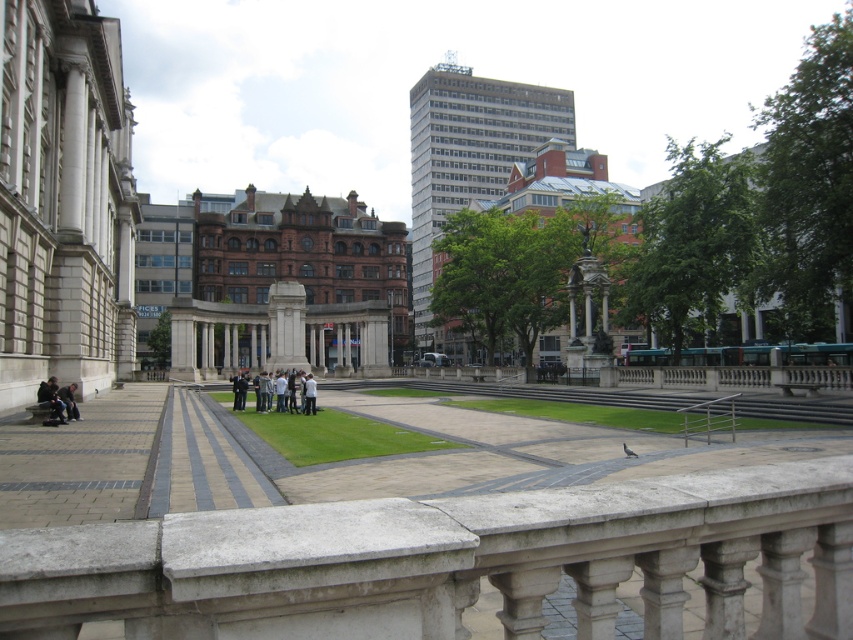
Question: Where is gray concrete path at center located in relation to dark gray stone bench at lower left in the image?

Choices:
 (A) below
 (B) above

Answer: (A)

Question: Which object is farther from the camera taking this photo?

Choices:
 (A) gray concrete path at center
 (B) light gray concrete people at center
 (C) dark gray stone bench at lower left
 (D) dark gray fabric jacket at lower left

Answer: (B)

Question: Which point is farther from the camera taking this photo?

Choices:
 (A) (73, 413)
 (B) (283, 408)
 (C) (45, 387)
 (D) (180, 499)

Answer: (B)

Question: Which object is the farthest from the dark gray fabric jacket at lower left?

Choices:
 (A) gray concrete path at center
 (B) dark gray stone bench at lower left
 (C) light gray concrete people at center

Answer: (C)

Question: Where is gray concrete path at center located in relation to dark gray stone bench at lower left in the image?

Choices:
 (A) left
 (B) right

Answer: (B)

Question: Does gray concrete path at center have a larger size compared to light gray concrete people at center?

Choices:
 (A) yes
 (B) no

Answer: (A)